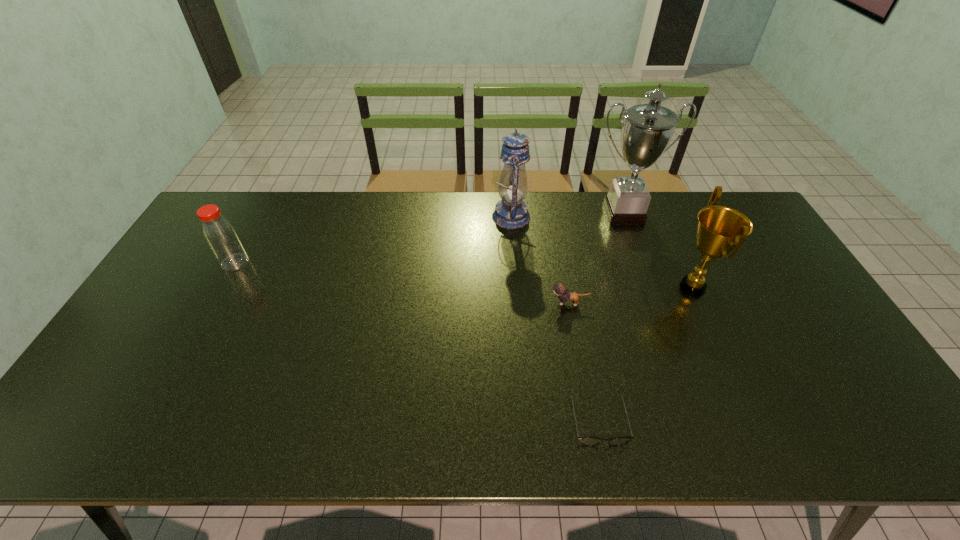
Image resolution: width=960 pixels, height=540 pixels. Identify the location of vacant region that satisfies the following two spatial constraints: 1. at the front view of the tallest object; 2. on the front-facing side of the lantern. (625, 217).

Locate an element on the screen. vacant space that satisfies the following two spatial constraints: 1. on the front-facing side of the fifth object from right to left; 2. on the front side of the leftmost object is located at coordinates (515, 262).